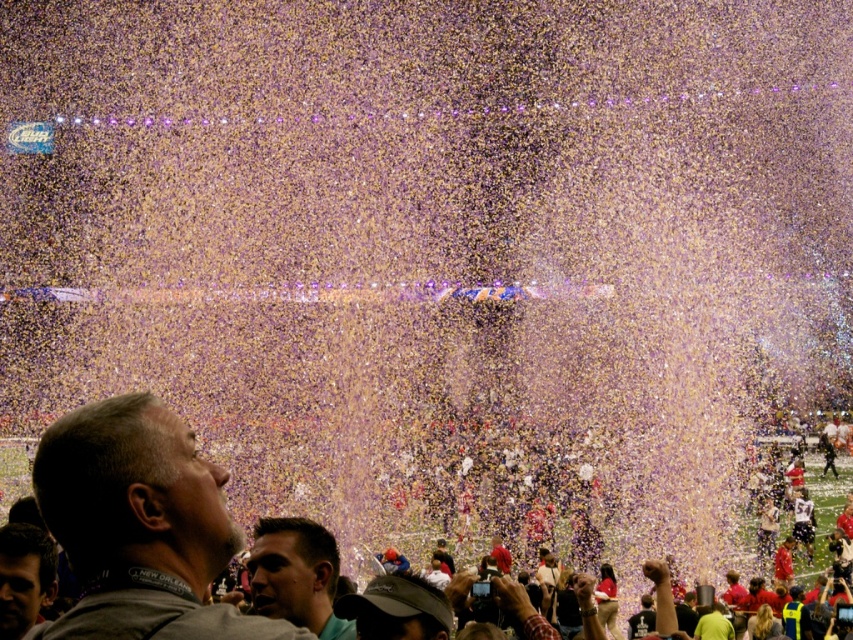
Does green matte shirt at lower center appear under smooth skin face at lower left?

No.

Can you confirm if green matte shirt at lower center is positioned to the right of smooth skin face at lower left?

Correct, you'll find green matte shirt at lower center to the right of smooth skin face at lower left.

Locate an element on the screen. The image size is (853, 640). green matte shirt at lower center is located at coordinates (296, 573).

Where is `green matte shirt at lower center`? The width and height of the screenshot is (853, 640). green matte shirt at lower center is located at coordinates (296, 573).

Can you confirm if gray fabric shirt at lower left is taller than smooth skin face at lower left?

Yes.

Does gray fabric shirt at lower left have a lesser width compared to smooth skin face at lower left?

No.

Which is behind, point (90, 605) or point (10, 582)?

Positioned behind is point (10, 582).

In order to click on gray fabric shirt at lower left in this screenshot , I will do `click(138, 525)`.

How much distance is there between gray fabric shirt at lower left and multicolored confetti at center?

19.93 inches

Between gray fabric shirt at lower left and multicolored confetti at center, which one has more height?

With more height is multicolored confetti at center.

Locate an element on the screen. The image size is (853, 640). gray fabric shirt at lower left is located at coordinates (138, 525).